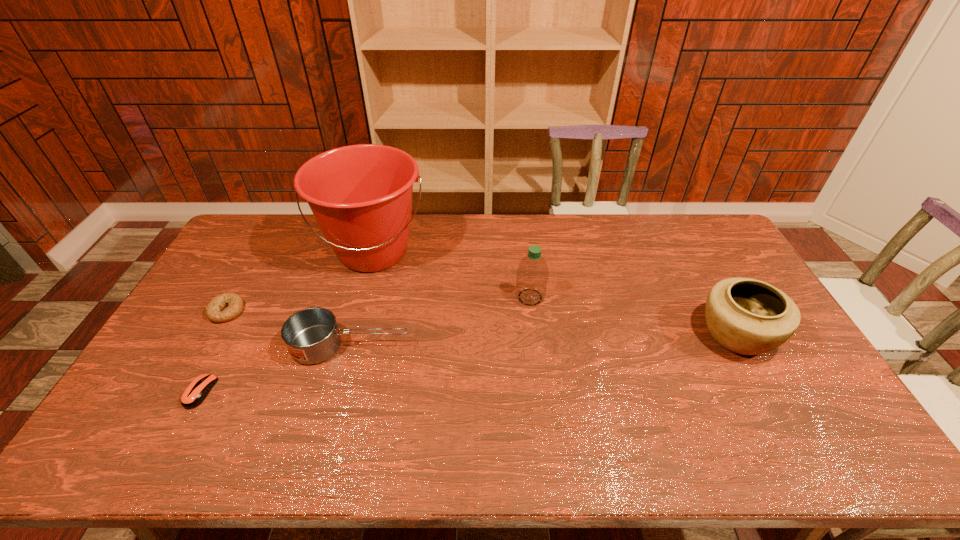
Identify the location of vacant area between the fourth shortest object and the tallest object. Image resolution: width=960 pixels, height=540 pixels. (555, 293).

You are a GUI agent. You are given a task and a screenshot of the screen. Output one action in this format:
    pyautogui.click(x=<x>, y=<y>)
    Task: Click on the vacant area that lies between the bucket and the saucepan
    Image resolution: width=960 pixels, height=540 pixels.
    Given the screenshot: What is the action you would take?
    pyautogui.click(x=362, y=299)

Locate an element on the screen. This screenshot has width=960, height=540. free space between the saucepan and the shortest object is located at coordinates (276, 369).

What are the coordinates of `vacant area between the rightmost object and the third shortest object` in the screenshot? It's located at (543, 340).

Locate an element on the screen. The width and height of the screenshot is (960, 540). object that is the third closest to the tallest object is located at coordinates (532, 273).

The width and height of the screenshot is (960, 540). I want to click on object that is the nearest to the saucepan, so click(361, 195).

You are a GUI agent. You are given a task and a screenshot of the screen. Output one action in this format:
    pyautogui.click(x=<x>, y=<y>)
    Task: Click on the free space that satisfies the following two spatial constraints: 1. on the back side of the computer mouse; 2. on the right side of the pottery
    
    Given the screenshot: What is the action you would take?
    pyautogui.click(x=230, y=335)

At what (x,y) coordinates should I click in order to perform the action: click on vacant space that satisfies the following two spatial constraints: 1. on the back side of the rightmost object; 2. on the right side of the shortest object. Please return your answer as a coordinate pair (x, y). This screenshot has height=540, width=960. Looking at the image, I should click on (230, 335).